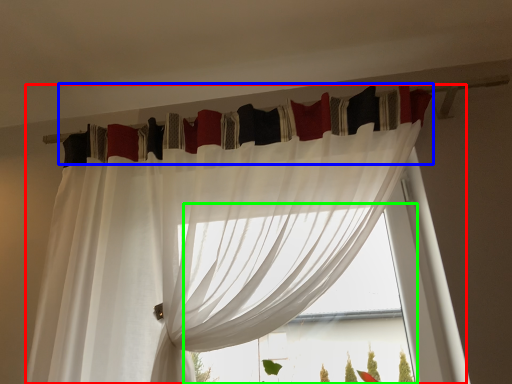
Question: Estimate the real-world distances between objects in this image. Which object is closer to curtain (highlighted by a red box), curtain (highlighted by a blue box) or bay window (highlighted by a green box)?

Choices:
 (A) curtain
 (B) bay window

Answer: (A)